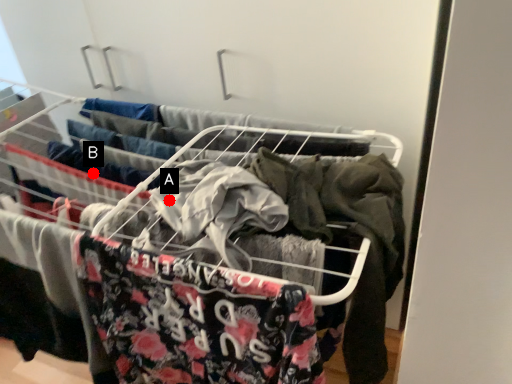
Question: Two points are circled on the image, labeled by A and B beside each circle. Which point is farther from the camera taking this photo?

Choices:
 (A) A is further
 (B) B is further

Answer: (B)